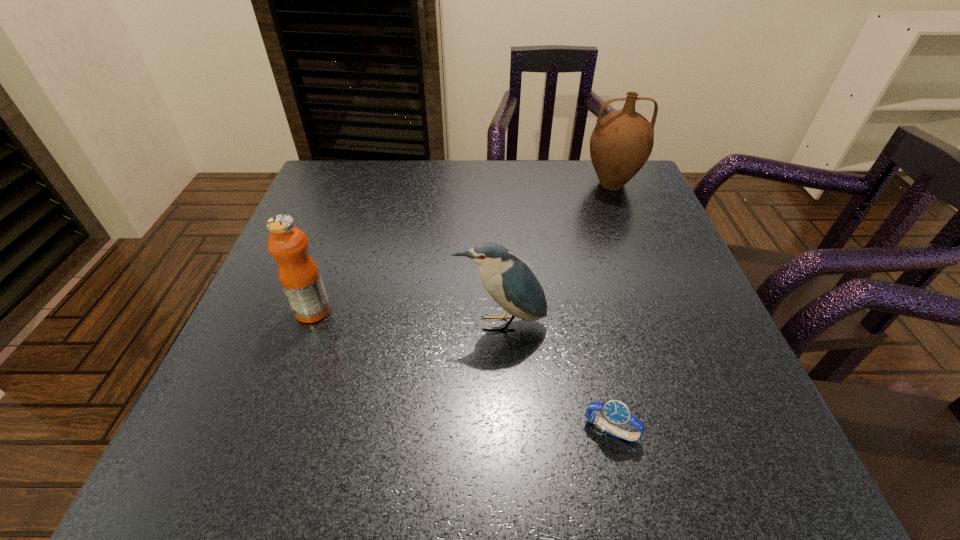
Identify which object is the nearest to the rightmost object. Please provide its 2D coordinates. Your answer should be formatted as a tuple, i.e. [(x, y)], where the tuple contains the x and y coordinates of a point satisfying the conditions above.

[(509, 281)]

Where is `object that ranks as the second closest to the leftmost object`? The height and width of the screenshot is (540, 960). object that ranks as the second closest to the leftmost object is located at coordinates (616, 413).

This screenshot has height=540, width=960. I want to click on vacant area in the image that satisfies the following two spatial constraints: 1. on the back side of the rightmost object; 2. on the left side of the fruit juice, so click(x=359, y=184).

Where is `vacant space that satisfies the following two spatial constraints: 1. at the tip of the second object from left to right's beak; 2. on the right side of the watch`? vacant space that satisfies the following two spatial constraints: 1. at the tip of the second object from left to right's beak; 2. on the right side of the watch is located at coordinates point(505,430).

You are a GUI agent. You are given a task and a screenshot of the screen. Output one action in this format:
    pyautogui.click(x=<x>, y=<y>)
    Task: Click on the free space in the image that satisfies the following two spatial constraints: 1. on the back side of the fruit juice; 2. on the right side of the pitcher
    Image resolution: width=960 pixels, height=540 pixels.
    Given the screenshot: What is the action you would take?
    pyautogui.click(x=359, y=184)

Identify the location of vacant point that satisfies the following two spatial constraints: 1. at the tip of the shortest object's beak; 2. on the left side of the bird. (505, 430).

Find the location of `vacant space that satisfies the following two spatial constraints: 1. at the tip of the bird's beak; 2. on the left side of the shortest object`. vacant space that satisfies the following two spatial constraints: 1. at the tip of the bird's beak; 2. on the left side of the shortest object is located at coordinates (505, 430).

Where is `free space that satisfies the following two spatial constraints: 1. on the back side of the rightmost object; 2. on the left side of the leftmost object`? The height and width of the screenshot is (540, 960). free space that satisfies the following two spatial constraints: 1. on the back side of the rightmost object; 2. on the left side of the leftmost object is located at coordinates (359, 184).

Image resolution: width=960 pixels, height=540 pixels. Identify the location of blank space that satisfies the following two spatial constraints: 1. on the back side of the second object from right to left; 2. on the right side of the pitcher. (555, 184).

Locate an element on the screen. vacant position in the image that satisfies the following two spatial constraints: 1. at the tip of the third object from right to left's beak; 2. on the right side of the third object from left to right is located at coordinates (505, 430).